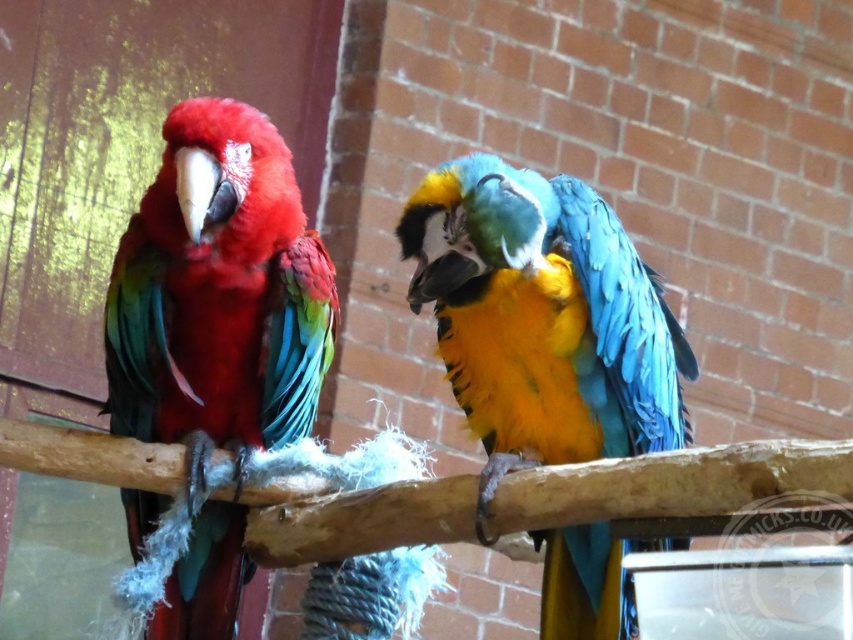
Question: Is blue-green feathers parrot at center smaller than matte green parrot at center?

Choices:
 (A) no
 (B) yes

Answer: (A)

Question: Is blue-green feathers parrot at center smaller than matte green parrot at center?

Choices:
 (A) yes
 (B) no

Answer: (B)

Question: Is blue-green feathers parrot at center smaller than matte green parrot at center?

Choices:
 (A) no
 (B) yes

Answer: (A)

Question: Which object is the closest to the wooden branch at center?

Choices:
 (A) matte green parrot at center
 (B) blue-green feathers parrot at center

Answer: (B)

Question: Which object is the closest to the matte green parrot at center?

Choices:
 (A) blue-green feathers parrot at center
 (B) wooden branch at center

Answer: (B)

Question: Among these points, which one is farthest from the camera?

Choices:
 (A) (614, 305)
 (B) (122, 445)

Answer: (B)